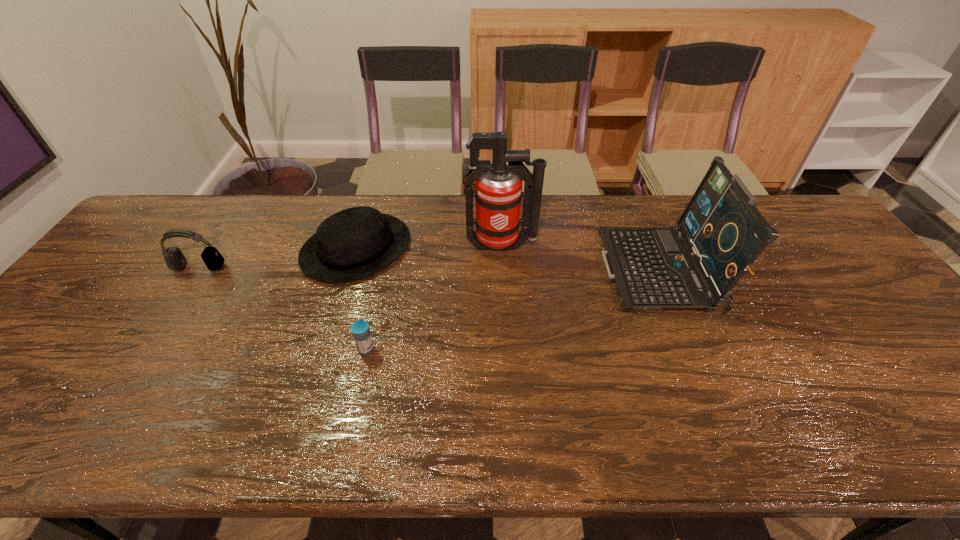
Locate an element on the screen. The height and width of the screenshot is (540, 960). vacant region between the tallest object and the fedora is located at coordinates pyautogui.click(x=429, y=247).

Locate an element on the screen. The height and width of the screenshot is (540, 960). blank region between the headset and the shortest object is located at coordinates (x=282, y=308).

You are a GUI agent. You are given a task and a screenshot of the screen. Output one action in this format:
    pyautogui.click(x=<x>, y=<y>)
    Task: Click on the vacant area that lies between the nearest object and the second shortest object
    
    Given the screenshot: What is the action you would take?
    pyautogui.click(x=361, y=299)

You are a GUI agent. You are given a task and a screenshot of the screen. Output one action in this format:
    pyautogui.click(x=<x>, y=<y>)
    Task: Click on the vacant point located between the second tallest object and the medicine
    This screenshot has height=540, width=960.
    Given the screenshot: What is the action you would take?
    pyautogui.click(x=513, y=310)

You are a GUI agent. You are given a task and a screenshot of the screen. Output one action in this format:
    pyautogui.click(x=<x>, y=<y>)
    Task: Click on the unoccupied position between the laptop computer and the fedora
    The width and height of the screenshot is (960, 540).
    Given the screenshot: What is the action you would take?
    pyautogui.click(x=508, y=260)

Identify which object is the closest to the second tallest object. Please provide its 2D coordinates. Your answer should be formatted as a tuple, i.e. [(x, y)], where the tuple contains the x and y coordinates of a point satisfying the conditions above.

[(498, 187)]

In order to click on object that is the fourth nearest to the shortest object in this screenshot , I will do `click(724, 232)`.

Image resolution: width=960 pixels, height=540 pixels. I want to click on free space that satisfies the following two spatial constraints: 1. on the front-facing side of the rightmost object; 2. on the front side of the medicine, so click(x=692, y=349).

What are the coordinates of `vacant position in the image that satisfies the following two spatial constraints: 1. on the headband of the medicine; 2. on the left side of the leftmost object` in the screenshot? It's located at (146, 349).

This screenshot has height=540, width=960. Identify the location of vacant position in the image that satisfies the following two spatial constraints: 1. on the headband of the headset; 2. on the left side of the shortest object. (146, 349).